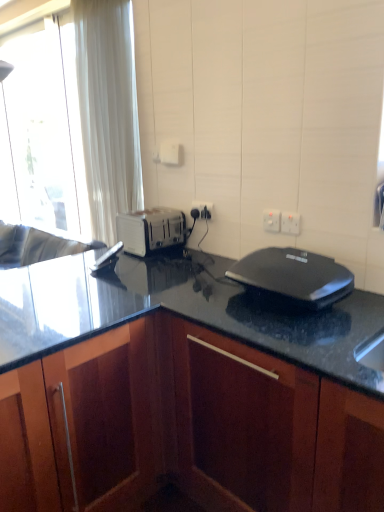
Question: Could you tell me if white curtain at left is facing dark wood cabinet at center?

Choices:
 (A) yes
 (B) no

Answer: (B)

Question: Can you confirm if white curtain at left is wider than dark wood cabinet at center?

Choices:
 (A) no
 (B) yes

Answer: (A)

Question: Is white curtain at left thinner than dark wood cabinet at center?

Choices:
 (A) no
 (B) yes

Answer: (B)

Question: Are white curtain at left and dark wood cabinet at center located far from each other?

Choices:
 (A) yes
 (B) no

Answer: (A)

Question: Is dark wood cabinet at center surrounded by white curtain at left?

Choices:
 (A) no
 (B) yes

Answer: (A)

Question: Does white curtain at left have a lesser height compared to dark wood cabinet at center?

Choices:
 (A) no
 (B) yes

Answer: (A)

Question: Does white plastic electric outlet at upper right, which is counted as the 2th electric outlet, starting from the back, have a smaller size compared to white curtain at left?

Choices:
 (A) no
 (B) yes

Answer: (B)

Question: Does white plastic electric outlet at upper right, marked as the 2th electric outlet in a front-to-back arrangement, come in front of white curtain at left?

Choices:
 (A) yes
 (B) no

Answer: (A)

Question: Is white plastic electric outlet at upper right, the second electric outlet viewed from the left, to the right of white curtain at left from the viewer's perspective?

Choices:
 (A) yes
 (B) no

Answer: (A)

Question: From a real-world perspective, is white plastic electric outlet at upper right, which is counted as the 2th electric outlet, starting from the back, located beneath white curtain at left?

Choices:
 (A) yes
 (B) no

Answer: (A)

Question: From a real-world perspective, is white plastic electric outlet at upper right, acting as the 2th electric outlet starting from the right, physically above white curtain at left?

Choices:
 (A) no
 (B) yes

Answer: (A)

Question: Is white plastic electric outlet at upper right, which is counted as the 2th electric outlet, starting from the back, positioned with its back to white curtain at left?

Choices:
 (A) no
 (B) yes

Answer: (A)

Question: From a real-world perspective, is black plastic sandwich maker at center on white curtain at left?

Choices:
 (A) no
 (B) yes

Answer: (A)